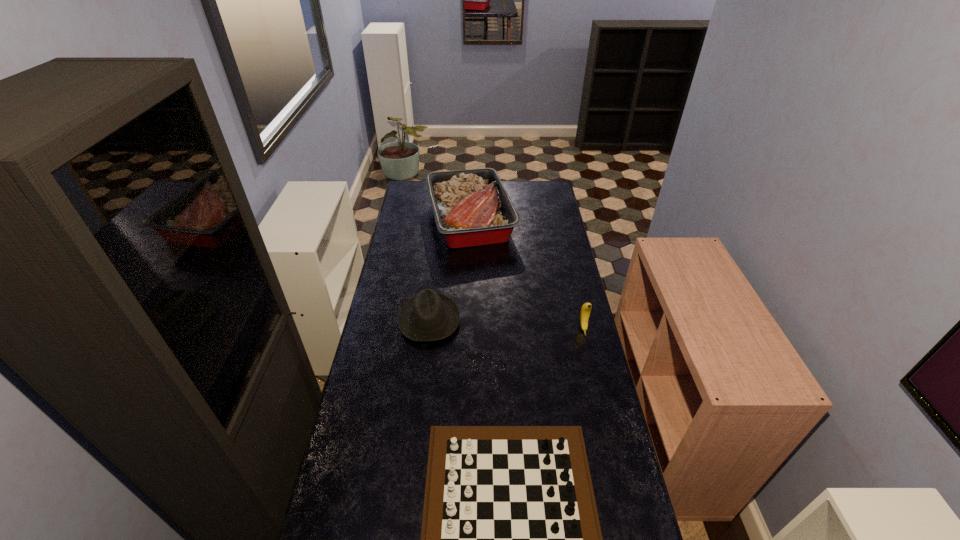
Select which object is the closest to the tray. Please provide its 2D coordinates. Your answer should be formatted as a tuple, i.e. [(x, y)], where the tuple contains the x and y coordinates of a point satisfying the conditions above.

[(430, 316)]